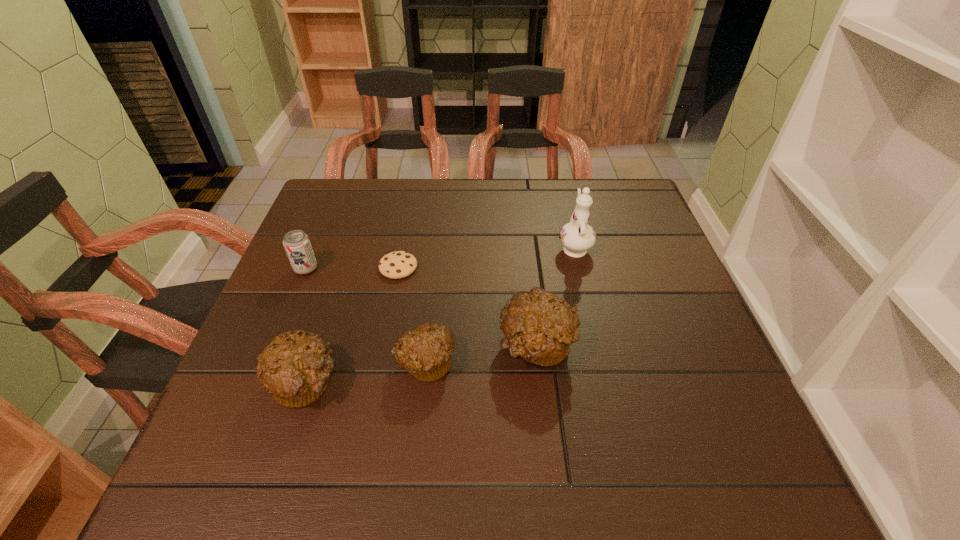
Given the evenly spaced muffins in the image, where should an extra muffin be added on the right to preserve the spacing? Please point to a vacant space. Please provide its 2D coordinates. Your answer should be formatted as a tuple, i.e. [(x, y)], where the tuple contains the x and y coordinates of a point satisfying the conditions above.

[(640, 329)]